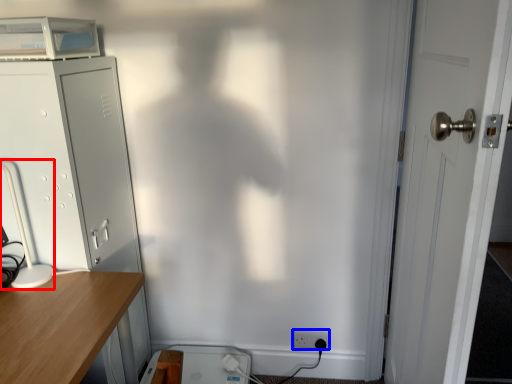
Question: Which point is closer to the camera, table lamp (highlighted by a red box) or electric outlet (highlighted by a blue box)?

Choices:
 (A) table lamp
 (B) electric outlet

Answer: (A)